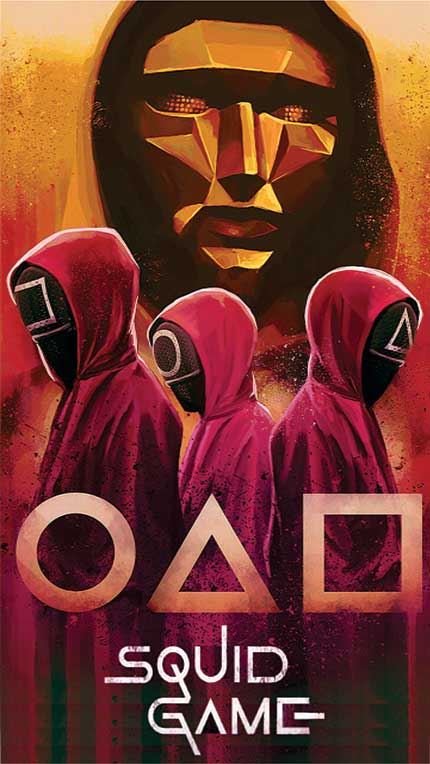
I want to click on hood, so click(90, 261), click(220, 332), click(348, 295), click(122, 24).